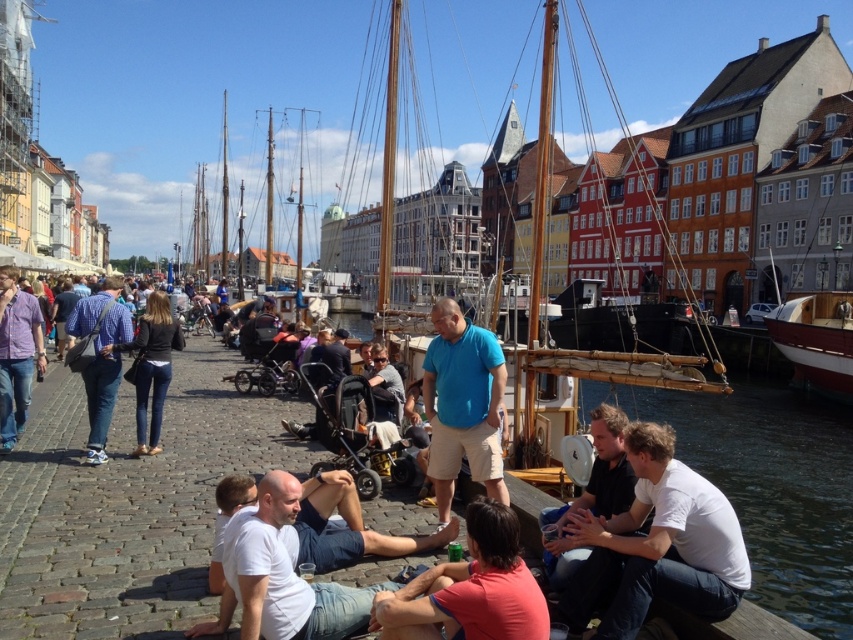
Does blue cotton shirt at center appear on the left side of light brown wooden chair at center?

Incorrect, blue cotton shirt at center is not on the left side of light brown wooden chair at center.

Between blue cotton shirt at center and light brown wooden chair at center, which one is positioned lower?

blue cotton shirt at center is below.

You are a GUI agent. You are given a task and a screenshot of the screen. Output one action in this format:
    pyautogui.click(x=<x>, y=<y>)
    Task: Click on the blue cotton shirt at center
    The width and height of the screenshot is (853, 640).
    Given the screenshot: What is the action you would take?
    pyautogui.click(x=462, y=404)

Which is behind, point (42, 365) or point (387, 362)?

The point (387, 362) is more distant.

Does point (4, 268) lie in front of point (386, 369)?

Yes, point (4, 268) is closer to viewer.

Image resolution: width=853 pixels, height=640 pixels. I want to click on matte purple shirt at left, so click(16, 355).

Is white cotton shirt at lower center bigger than blue cotton shirt at center?

Yes.

Identify the location of white cotton shirt at lower center. Image resolution: width=853 pixels, height=640 pixels. (300, 560).